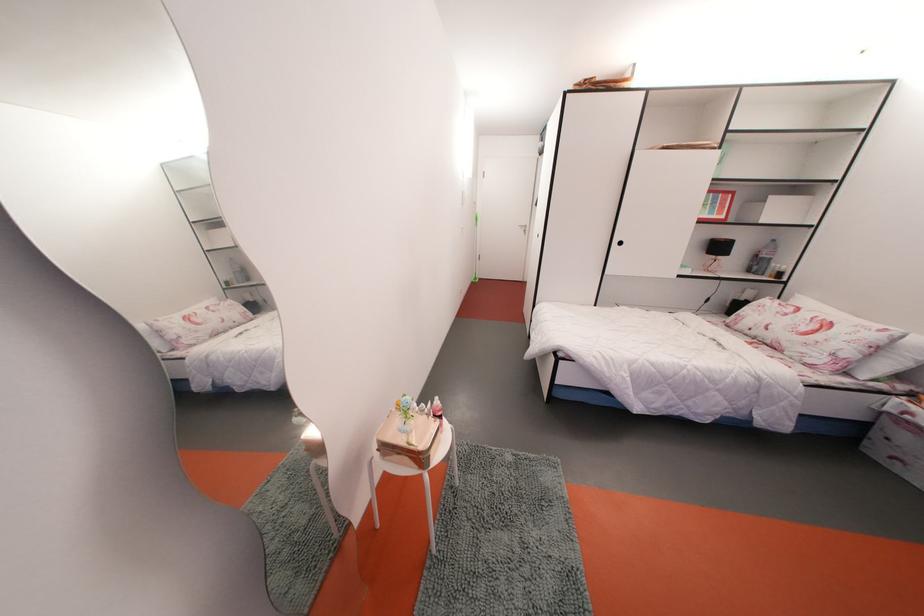
What do you see at coordinates (619, 243) in the screenshot? The image size is (924, 616). I see `the cabinet door handle` at bounding box center [619, 243].